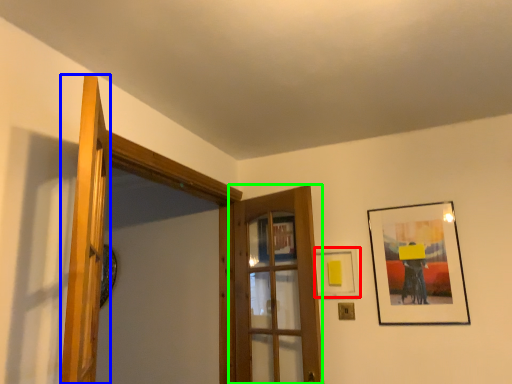
Question: Estimate the real-world distances between objects in this image. Which object is closer to picture frame (highlighted by a red box), door (highlighted by a blue box) or door (highlighted by a green box)?

Choices:
 (A) door
 (B) door

Answer: (B)